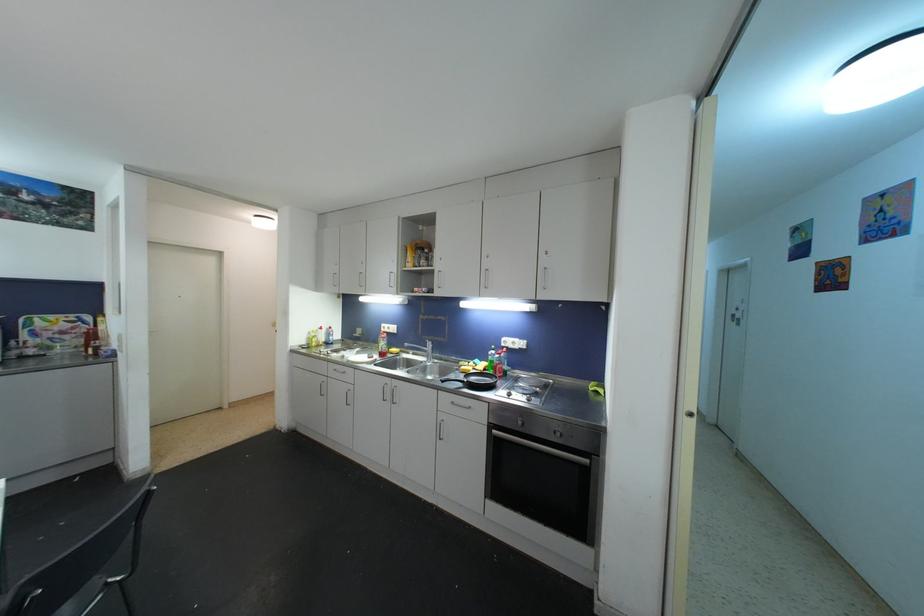
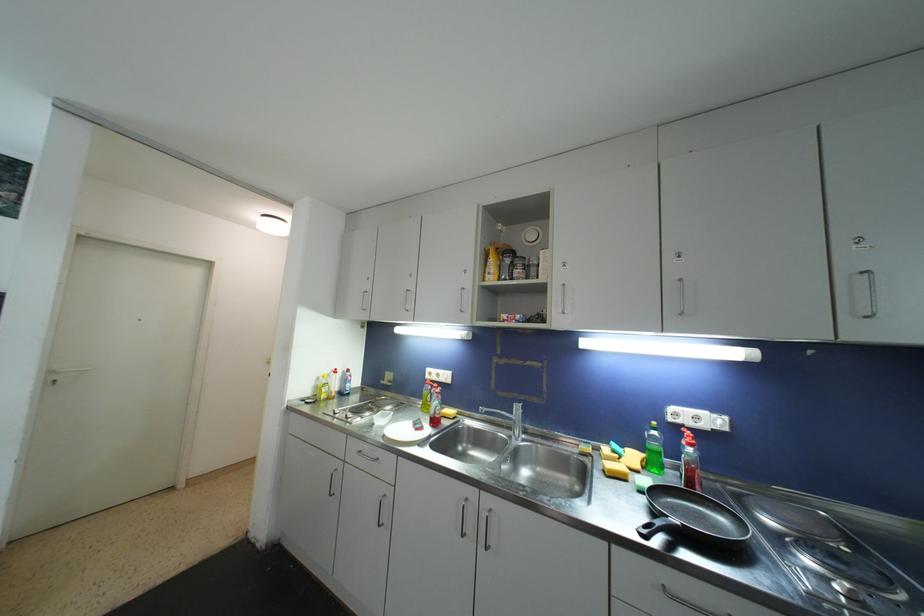
Locate, in the second image, the point that corresponds to [432,347] in the first image.

(520, 411)